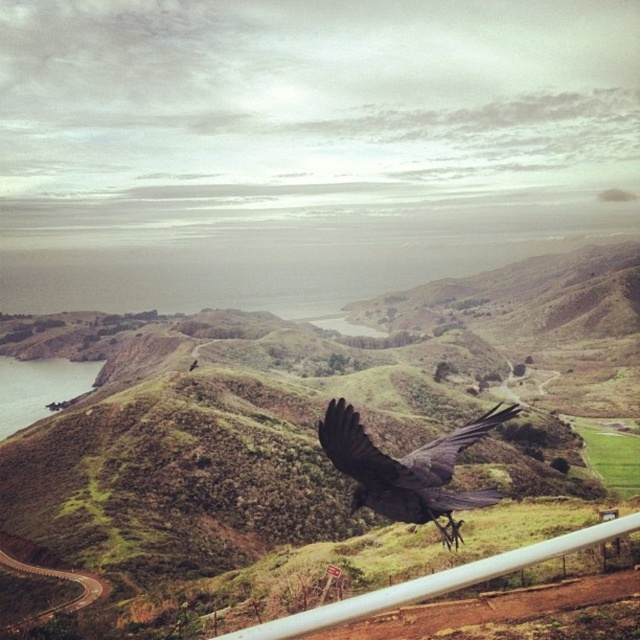
You are a hiker standing at the cliff edge looking at the green grassy hillside at center and the shiny black crow at center. Which object is taller?

The green grassy hillside at center is taller than the shiny black crow at center.

You are a photographer standing at the cliff edge. You want to capture a photo of the shiny black crow at center and the white plastic fence at lower right in the same frame. Which object should you focus on first to ensure both are in focus?

You should focus on the shiny black crow at center first because it is closer to you than the white plastic fence at lower right. By focusing on the closer object, the fence will also be in focus due to the depth of field.

Looking at this image, you are a photographer trying to capture the shiny black crow at center while ensuring the green grassy hillside at center is visible in the background. Based on their sizes, which object should you focus on to ensure both are in frame?

The green grassy hillside at center is bigger than the shiny black crow at center, so focusing on the green grassy hillside at center would allow the crow to be in the background while maintaining both in the frame.